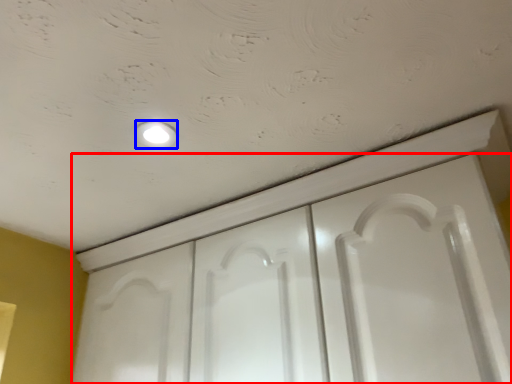
Question: Which object appears closest to the camera in this image, door (highlighted by a red box) or dot (highlighted by a blue box)?

Choices:
 (A) door
 (B) dot

Answer: (A)